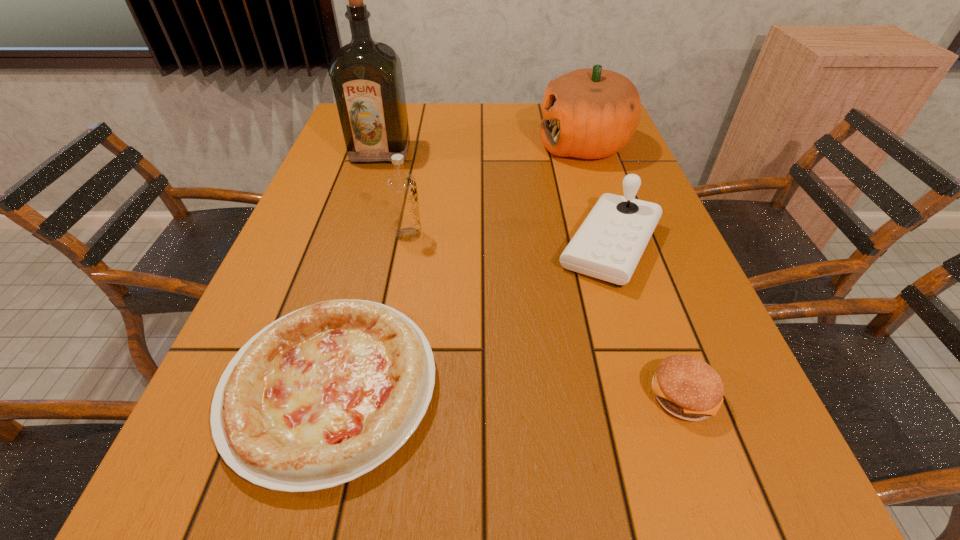
Locate an element on the screen. The image size is (960, 540). liquor is located at coordinates (366, 76).

Where is `pumpkin`? This screenshot has width=960, height=540. pumpkin is located at coordinates (591, 113).

Find the location of a particular element. vodka is located at coordinates (401, 186).

The height and width of the screenshot is (540, 960). I want to click on joystick, so click(608, 245).

Find the location of a particular element. The width and height of the screenshot is (960, 540). hamburger is located at coordinates (687, 387).

Locate an element on the screen. The width and height of the screenshot is (960, 540). pizza is located at coordinates (323, 395).

Locate an element on the screen. The height and width of the screenshot is (540, 960). vacant space located 0.120m on the label of the tallest object is located at coordinates (370, 188).

Where is `free space located 0.180m on the face of the pumpkin`? free space located 0.180m on the face of the pumpkin is located at coordinates (479, 145).

I want to click on free space located 0.080m on the face of the pumpkin, so click(512, 145).

At what (x,y) coordinates should I click in order to perform the action: click on free spot located 0.350m on the face of the pumpkin. Please return your answer as a coordinate pair (x, y). Looking at the image, I should click on (424, 145).